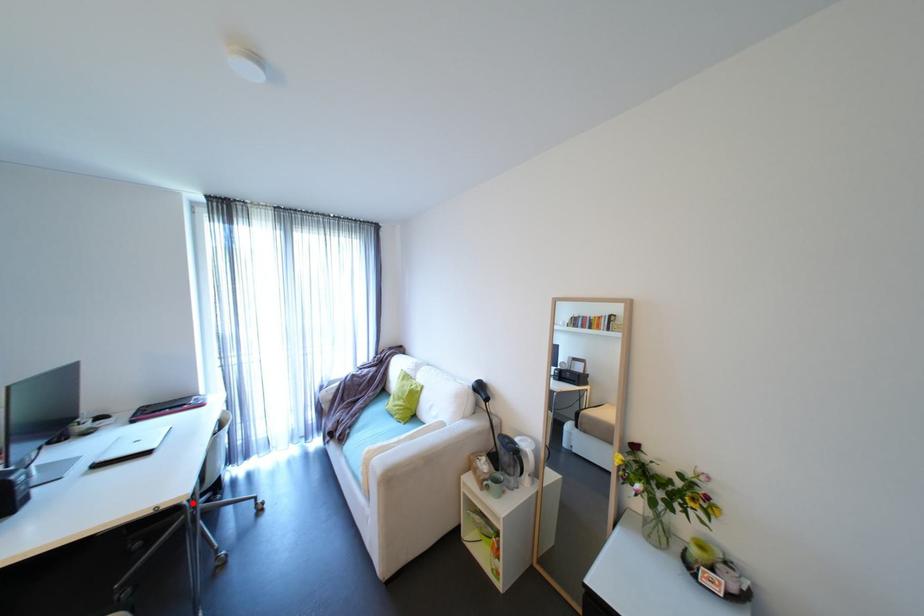
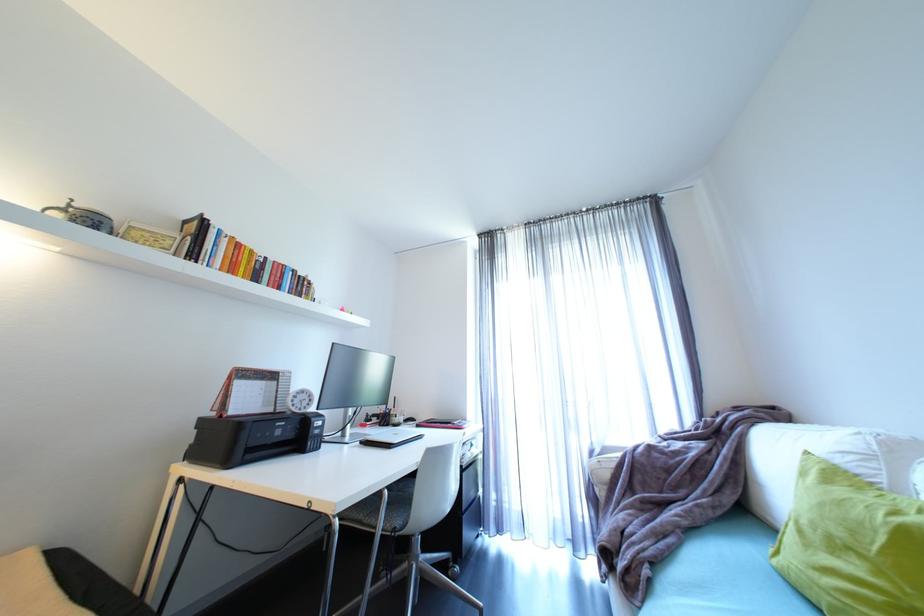
Where in the second image is the point corresponding to the highlighted location from the first image?

(344, 522)